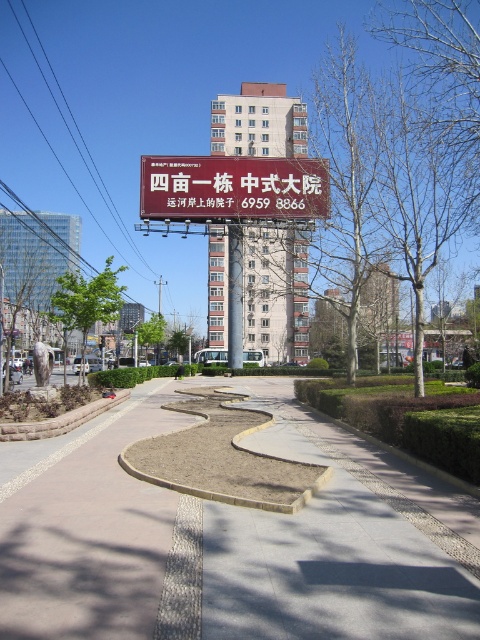
Question: Can you confirm if gray concrete pavement at center is positioned to the left of matte red sign at center?

Choices:
 (A) no
 (B) yes

Answer: (A)

Question: Which object is positioned farthest from the matte red sign at center?

Choices:
 (A) gray concrete pavement at center
 (B) metallic sign at center

Answer: (A)

Question: Can you confirm if gray concrete pavement at center is smaller than matte red sign at center?

Choices:
 (A) no
 (B) yes

Answer: (B)

Question: Among these points, which one is farthest from the camera?

Choices:
 (A) (152, 196)
 (B) (232, 337)

Answer: (B)

Question: Estimate the real-world distances between objects in this image. Which object is farther from the gray concrete pavement at center?

Choices:
 (A) matte red sign at center
 (B) metallic sign at center

Answer: (B)

Question: Considering the relative positions of matte red sign at center and metallic sign at center in the image provided, where is matte red sign at center located with respect to metallic sign at center?

Choices:
 (A) below
 (B) above

Answer: (B)